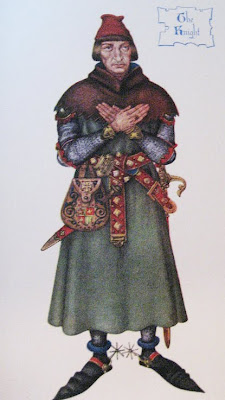
The height and width of the screenshot is (400, 225). I want to click on robe, so click(x=109, y=299).